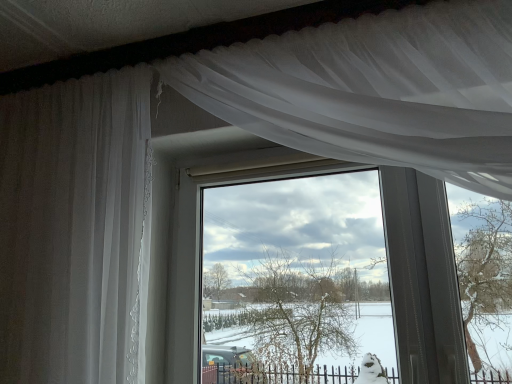
Identify the location of transparent glass window at center. The width and height of the screenshot is (512, 384). (291, 241).

Describe the element at coordinates (291, 241) in the screenshot. I see `transparent glass window at center` at that location.

Where is `transparent glass window at center`? The image size is (512, 384). transparent glass window at center is located at coordinates (291, 241).